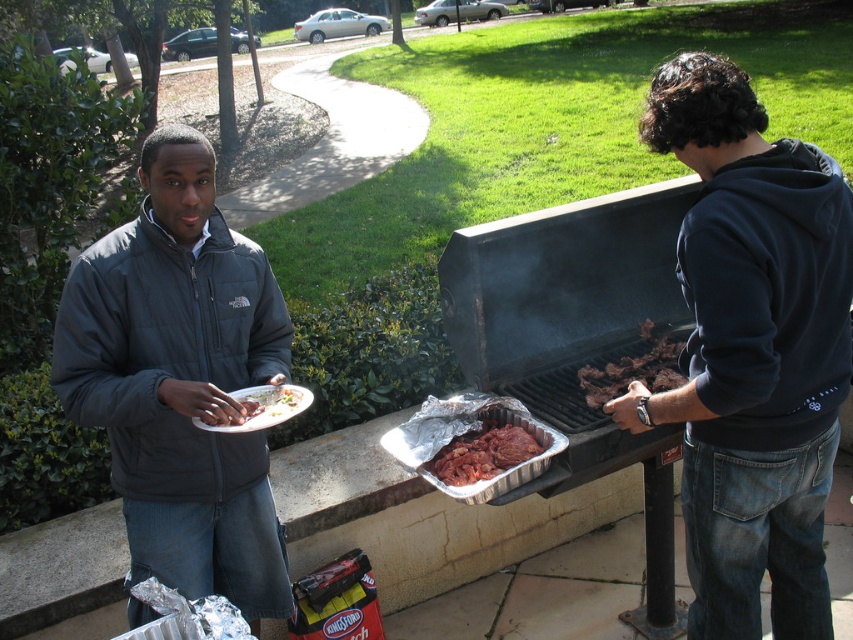
You are planning to take a photo of the dark gray fleece jacket at left and the raw red meat at center for a social media post. Which object should you zoom in on to ensure both are clearly visible in the frame?

The dark gray fleece jacket at left is larger in size compared to the raw red meat at center, so you should zoom in on the dark gray fleece jacket at left to ensure both are clearly visible in the frame.

You are a guest at the barbecue and want to grab a drink from the cooler located behind the grill. To avoid blocking the grill operator, you need to move around either the dark blue fleece sweatshirt at right or the brown charred meat at grill right. Which object should you go around to ensure you don t block their view?

You should go around the dark blue fleece sweatshirt at right because it is taller than the brown charred meat at grill right, so moving around the taller object will keep you out of the operator s line of sight.